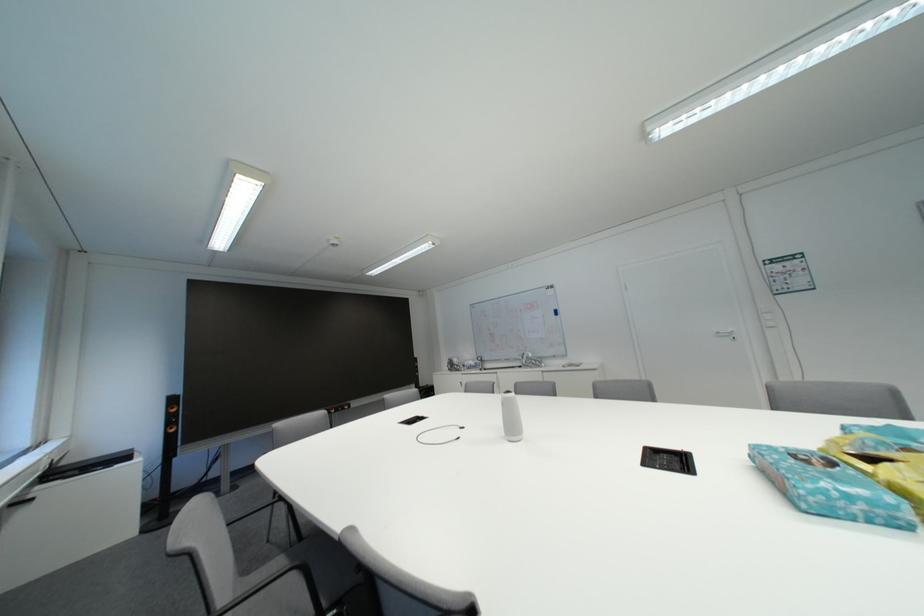
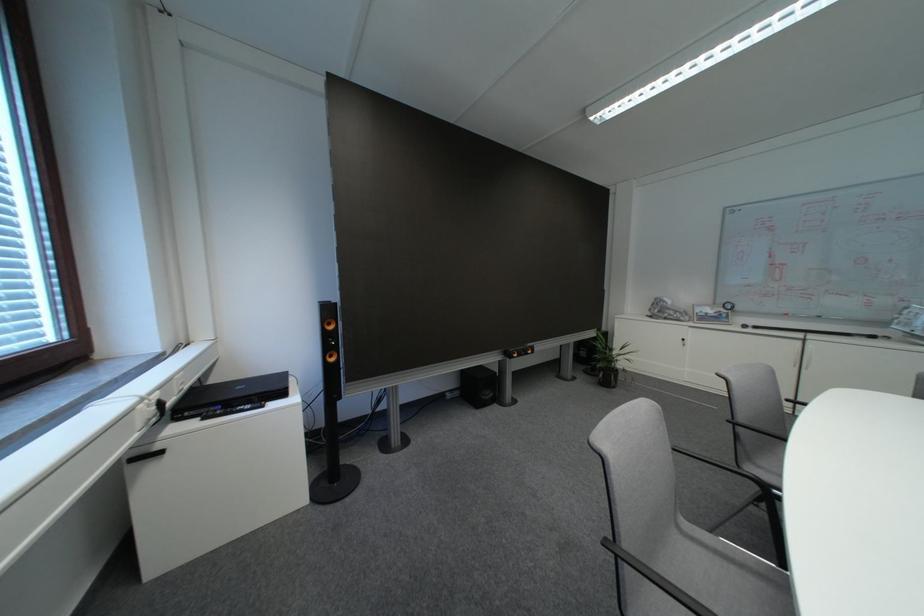
What movement of the cameraman would produce the second image?

The movement direction of the cameraman is left, forward.